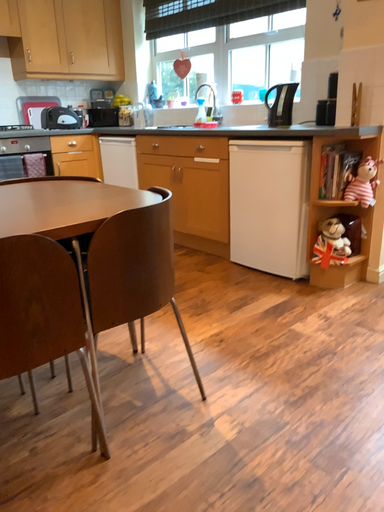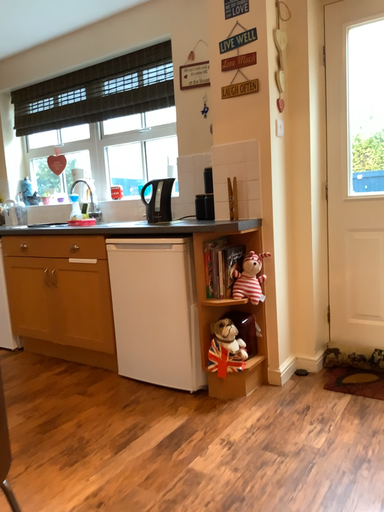
Question: Which way did the camera rotate in the video?

Choices:
 (A) rotated downward
 (B) rotated upward

Answer: (B)